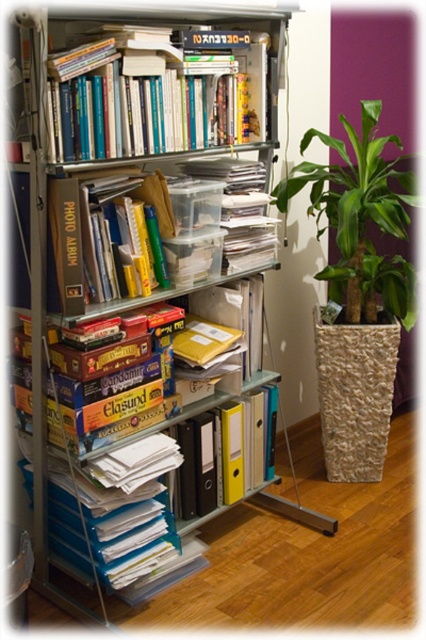
Question: Can you confirm if hardcover books at upper center is positioned to the left of green leafy plant at right?

Choices:
 (A) no
 (B) yes

Answer: (B)

Question: Does hardcover books at upper center lie in front of green leafy plant at right?

Choices:
 (A) no
 (B) yes

Answer: (B)

Question: Which object appears closest to the camera in this image?

Choices:
 (A) hardcover books at upper center
 (B) green leafy plant at right

Answer: (A)

Question: Can you confirm if hardcover books at upper center is positioned to the left of green leafy plant at right?

Choices:
 (A) no
 (B) yes

Answer: (B)